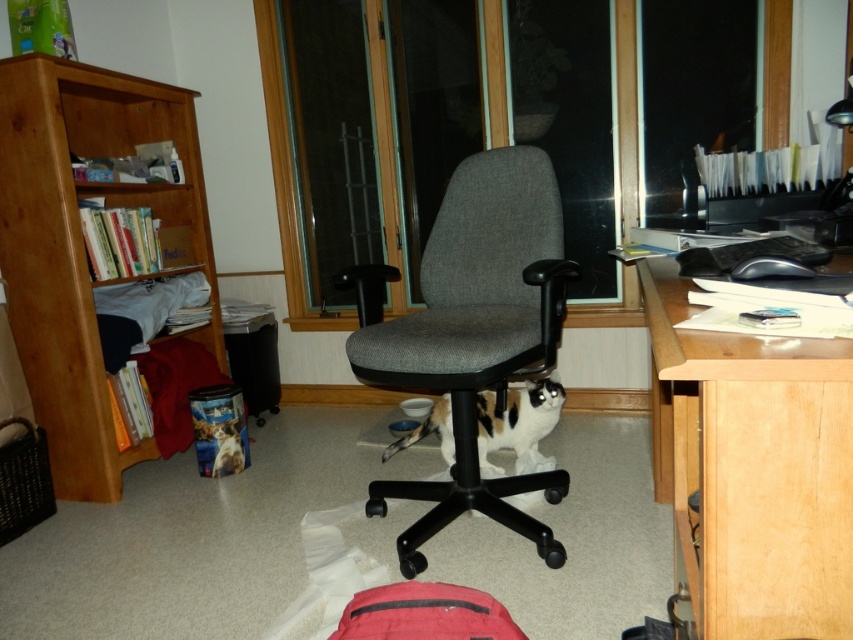
Question: Which object is the farthest from the calico fur cat at center?

Choices:
 (A) light brown wood computer desk at right
 (B) gray fabric swivel chair at center
 (C) light brown wood bookshelf at left

Answer: (C)

Question: Is light brown wood computer desk at right smaller than gray fabric swivel chair at center?

Choices:
 (A) no
 (B) yes

Answer: (B)

Question: Which is farther from the light brown wood computer desk at right?

Choices:
 (A) light brown wood bookshelf at left
 (B) calico fur cat at center
 (C) gray fabric swivel chair at center

Answer: (A)

Question: Where is gray fabric swivel chair at center located in relation to calico fur cat at center in the image?

Choices:
 (A) left
 (B) right

Answer: (A)

Question: Estimate the real-world distances between objects in this image. Which object is closer to the gray fabric swivel chair at center?

Choices:
 (A) light brown wood bookshelf at left
 (B) light brown wood computer desk at right

Answer: (B)

Question: Is the position of light brown wood bookshelf at left less distant than that of calico fur cat at center?

Choices:
 (A) no
 (B) yes

Answer: (A)